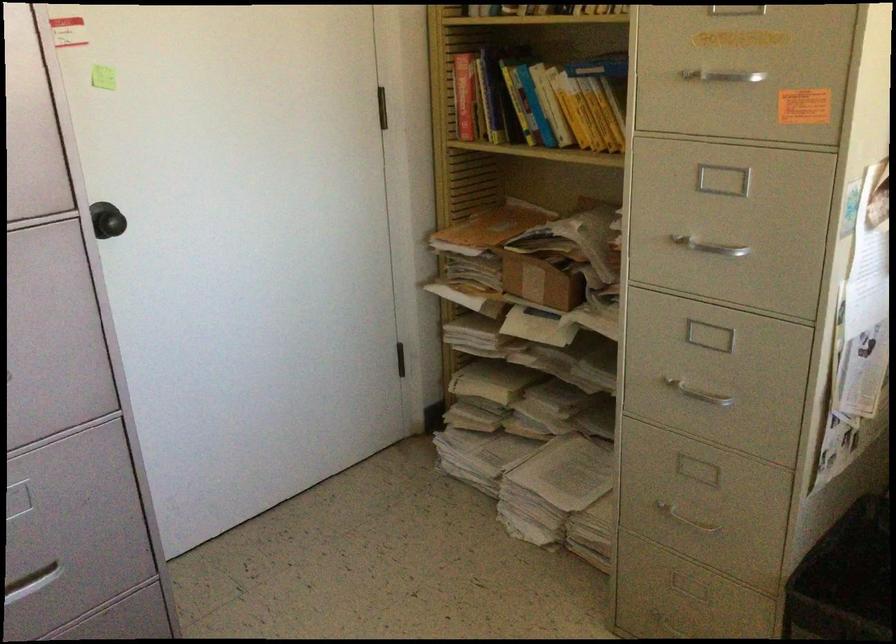
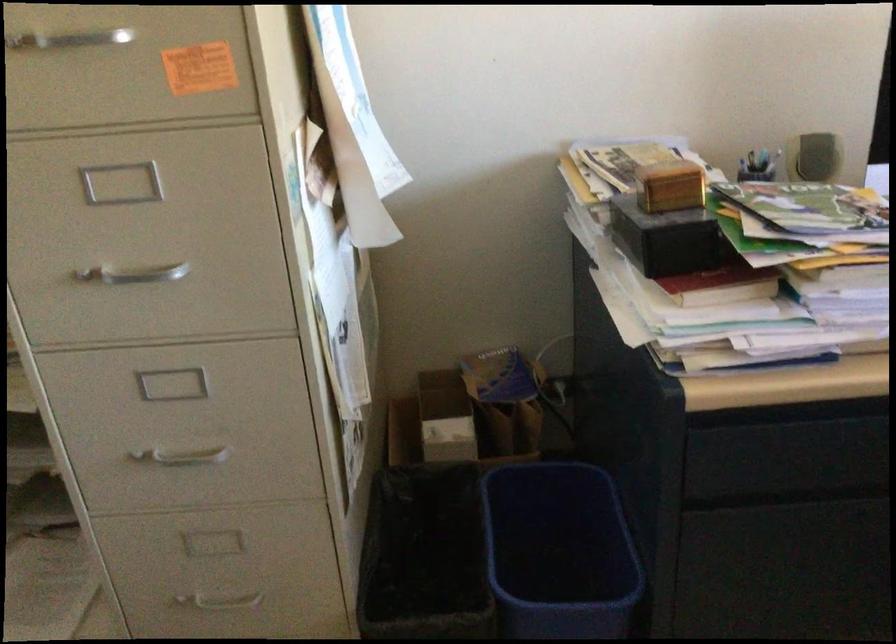
Question: Based on the continuous images, in which direction is the camera rotating? Reply with the corresponding letter.

Choices:
 (A) Left
 (B) Right
 (C) Up
 (D) Down

Answer: (B)